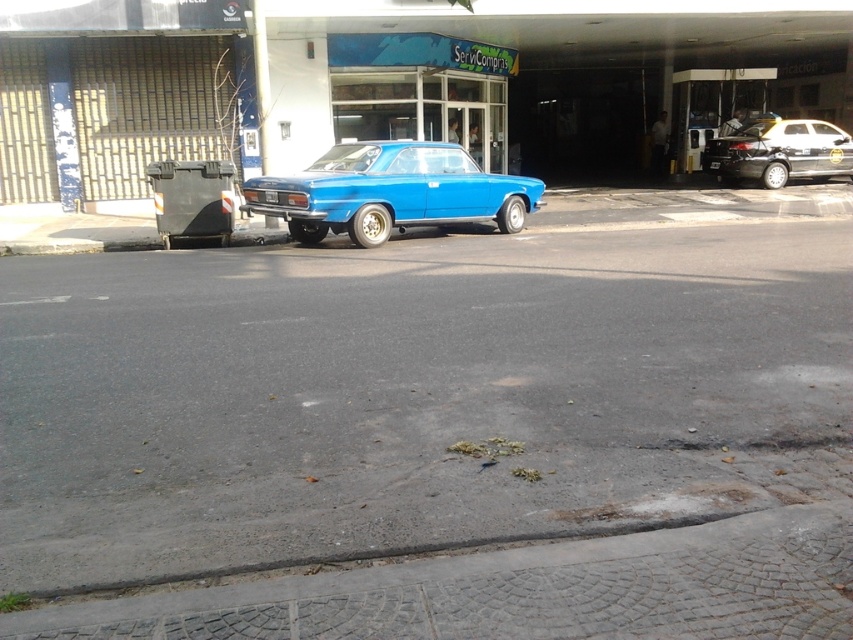
Who is positioned more to the right, matte blue car at center or shiny black sedan at right?

From the viewer's perspective, shiny black sedan at right appears more on the right side.

Who is more forward, (341, 186) or (830, 154)?

Point (341, 186)

Measure the distance between matte blue car at center and camera.

36.47 feet

This screenshot has width=853, height=640. In order to click on matte blue car at center in this screenshot , I will do `click(392, 192)`.

This screenshot has height=640, width=853. Describe the element at coordinates (392, 192) in the screenshot. I see `matte blue car at center` at that location.

Is point (471, 177) behind point (265, 193)?

Yes, point (471, 177) is behind point (265, 193).

Image resolution: width=853 pixels, height=640 pixels. Describe the element at coordinates (392, 192) in the screenshot. I see `matte blue car at center` at that location.

Find the location of a particular element. This screenshot has height=640, width=853. matte blue car at center is located at coordinates (392, 192).

Can you confirm if shiny black sedan at right is positioned to the left of blue glossy license plate at center?

In fact, shiny black sedan at right is to the right of blue glossy license plate at center.

Which is in front, point (786, 161) or point (270, 196)?

Point (270, 196)

Does point (773, 138) come farther from viewer compared to point (267, 195)?

Yes, it is.

Identify the location of shiny black sedan at right. The height and width of the screenshot is (640, 853). (780, 150).